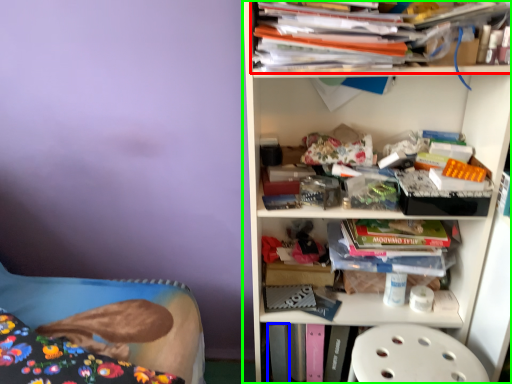
Question: Which object is the closest to the book (highlighted by a red box)? Choose among these: paperback book (highlighted by a blue box) or shelf (highlighted by a green box).

Choices:
 (A) paperback book
 (B) shelf

Answer: (B)